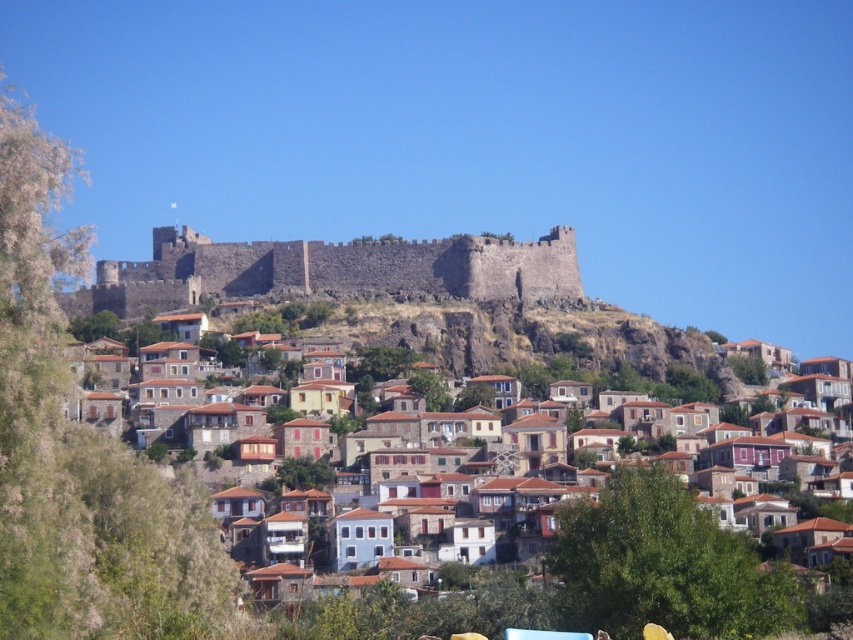
You are an architect examining the hillside town. You need to determine the spatial relationship between the brown stone houses at center and the dark stone wall at upper center. Which object is located to the right of the other?

The brown stone houses at center is positioned on the right side of dark stone wall at upper center.

You are an architect evaluating the spatial compatibility of the brown stone houses at center and the dark stone wall at upper center. Considering their sizes, which one would require more construction materials if both were to be built from scratch?

The brown stone houses at center require more construction materials because they are larger in size than the dark stone wall at upper center.